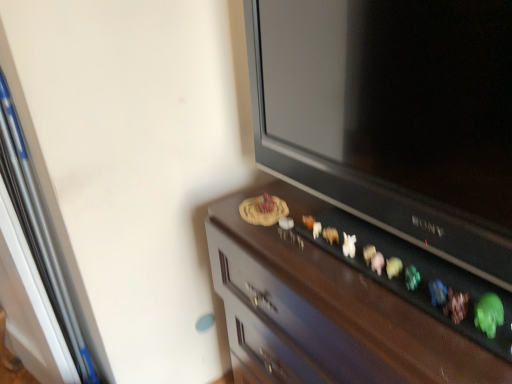
Question: From the image's perspective, relative to matte black television at upper right, is wooden cabinet at center above or below?

Choices:
 (A) below
 (B) above

Answer: (A)

Question: Visually, is wooden cabinet at center positioned to the left or to the right of matte black television at upper right?

Choices:
 (A) left
 (B) right

Answer: (B)

Question: Is wooden cabinet at center inside the boundaries of matte black television at upper right, or outside?

Choices:
 (A) outside
 (B) inside

Answer: (A)

Question: From their relative heights in the image, would you say matte black television at upper right is taller or shorter than wooden cabinet at center?

Choices:
 (A) short
 (B) tall

Answer: (A)

Question: Is point (505, 246) positioned closer to the camera than point (257, 372)?

Choices:
 (A) farther
 (B) closer

Answer: (B)

Question: Is matte black television at upper right bigger or smaller than wooden cabinet at center?

Choices:
 (A) big
 (B) small

Answer: (B)

Question: Is matte black television at upper right wider or thinner than wooden cabinet at center?

Choices:
 (A) wide
 (B) thin

Answer: (B)